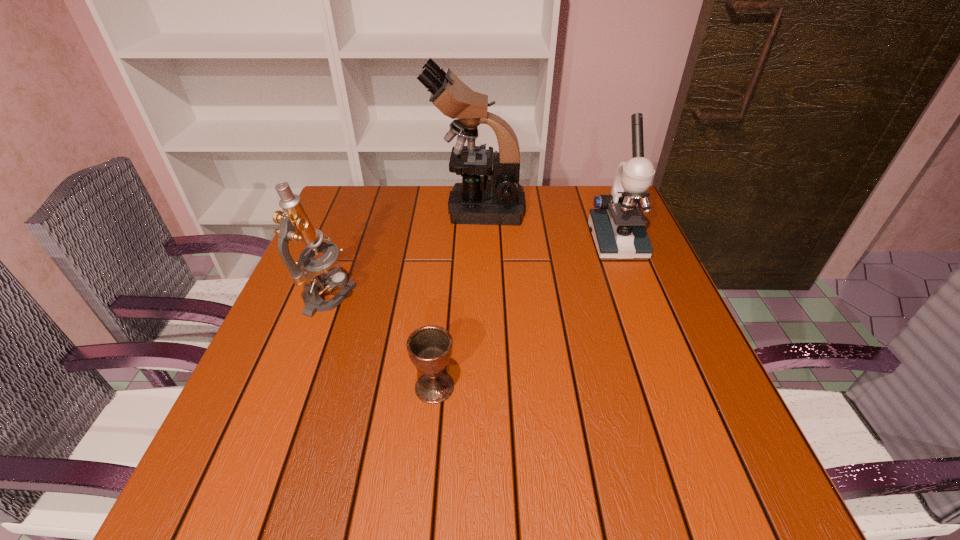
Find the location of a particular element. The image size is (960, 540). the second microscope from left to right is located at coordinates (485, 197).

Identify the location of the tallest object. The image size is (960, 540). (485, 197).

The width and height of the screenshot is (960, 540). What are the coordinates of `the rightmost object` in the screenshot? It's located at (618, 228).

I want to click on the third farthest object, so click(x=295, y=225).

Identify the location of the nearest microscope. tap(295, 225).

You are a GUI agent. You are given a task and a screenshot of the screen. Output one action in this format:
    pyautogui.click(x=<x>, y=<y>)
    Task: Click on the chalice
    The width and height of the screenshot is (960, 540).
    Given the screenshot: What is the action you would take?
    pyautogui.click(x=429, y=347)

Locate an element on the screen. the shortest object is located at coordinates (429, 347).

At what (x,y) coordinates should I click in order to perform the action: click on vacant space located on the front of the tallest object. Please return your answer as a coordinate pair (x, y). Looking at the image, I should click on (477, 244).

Where is `vacant area situated on the front of the rightmost microscope`? Image resolution: width=960 pixels, height=540 pixels. vacant area situated on the front of the rightmost microscope is located at coordinates (636, 293).

The image size is (960, 540). Find the location of `vacant space located on the right of the leftmost microscope`. vacant space located on the right of the leftmost microscope is located at coordinates (507, 297).